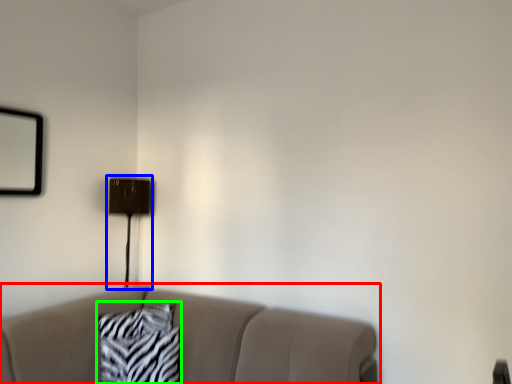
Question: Estimate the real-world distances between objects in this image. Which object is farther from studio couch (highlighted by a red box), table lamp (highlighted by a blue box) or pillow (highlighted by a green box)?

Choices:
 (A) table lamp
 (B) pillow

Answer: (A)